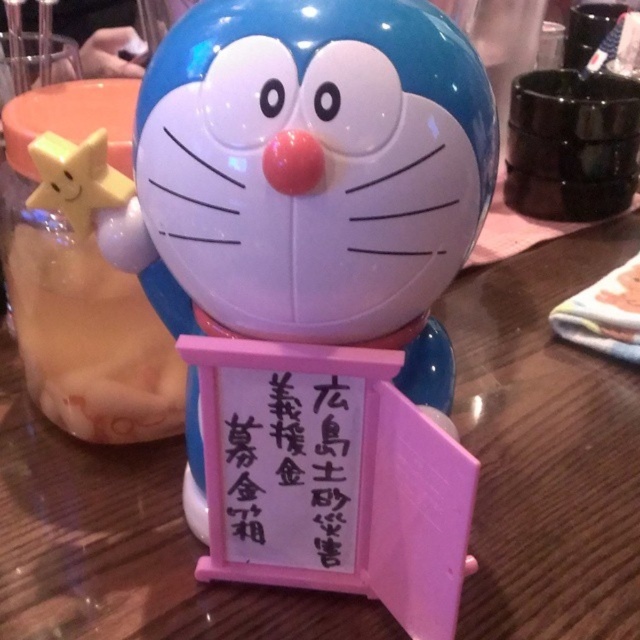
You are organizing a charity event and need to place the glossy plastic doraemon at center and the pink paper sign at center on a table. According to the image, which object should be placed higher to ensure both are visible?

The glossy plastic doraemon at center should be placed higher than the pink paper sign at center to ensure both are visible since the doraemon is located above the sign in the image.

You are organizing a charity event and need to place the glossy plastic doraemon at center and the pink paper sign at center on a table. According to the image, which object is located to the left of the other?

The glossy plastic doraemon at center is positioned on the right side of pink paper sign at center, so the pink paper sign at center is to the left of the glossy plastic doraemon at center.

You are organizing a charity event and need to place the glossy plastic doraemon at center and the pink paper sign at center on a table. Given their sizes, which object should you place first to ensure stability?

The glossy plastic doraemon at center is larger in size than the pink paper sign at center, so you should place the glossy plastic doraemon at center first to ensure stability.